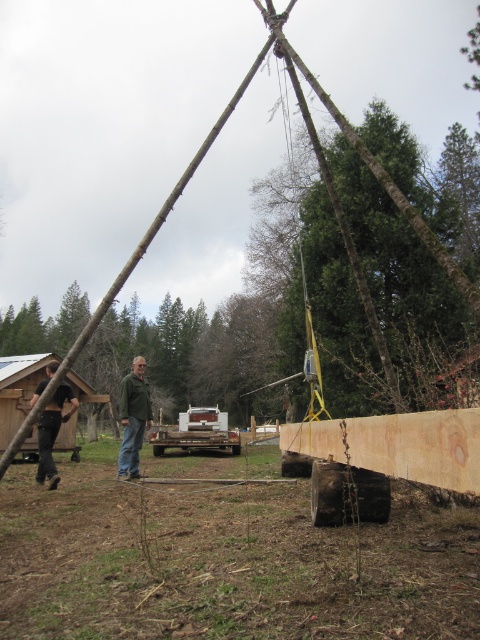
Question: Which object appears farthest from the camera in this image?

Choices:
 (A) green matte jacket at center
 (B) brown wood tree at center

Answer: (B)

Question: Does green matte jacket at center appear under black leather pants at lower left?

Choices:
 (A) no
 (B) yes

Answer: (A)

Question: Among these points, which one is nearest to the camera?

Choices:
 (A) (33, 401)
 (B) (132, 477)

Answer: (B)

Question: Does brown wood tree at center have a smaller size compared to green matte jacket at center?

Choices:
 (A) no
 (B) yes

Answer: (A)

Question: Does brown wood tree at center appear over black leather pants at lower left?

Choices:
 (A) yes
 (B) no

Answer: (B)

Question: Which point is closer to the camera taking this photo?

Choices:
 (A) (141, 372)
 (B) (57, 484)
 (C) (147, 337)

Answer: (B)